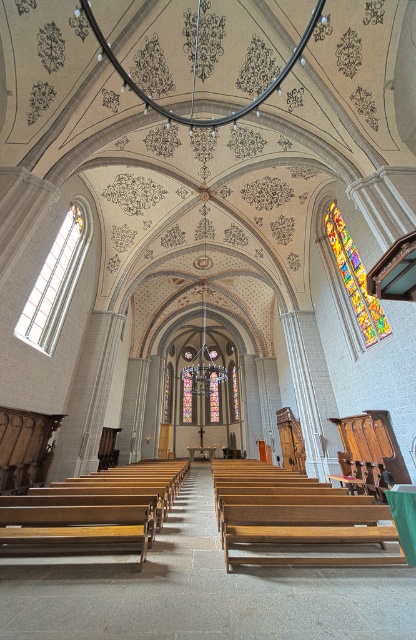
Image resolution: width=416 pixels, height=640 pixels. What are the coordinates of `wooden bench at center` in the screenshot? It's located at (93, 509).

Is point (160, 506) more distant than point (349, 285)?

That is False.

The image size is (416, 640). In order to click on wooden bench at center in this screenshot , I will do click(93, 509).

Does clear glass window at left have a greater height compared to multicolored stained glass at upper right?

Indeed, clear glass window at left has a greater height compared to multicolored stained glass at upper right.

Describe the element at coordinates (56, 282) in the screenshot. I see `clear glass window at left` at that location.

What are the coordinates of `clear glass window at left` in the screenshot? It's located at (56, 282).

Is wooden church bench at center positioned behind multicolored stained glass at upper right?

No, it is not.

Does wooden church bench at center have a lesser width compared to multicolored stained glass at upper right?

In fact, wooden church bench at center might be wider than multicolored stained glass at upper right.

What do you see at coordinates (297, 518) in the screenshot?
I see `wooden church bench at center` at bounding box center [297, 518].

At what (x,y) coordinates should I click in order to perform the action: click on wooden church bench at center. Please return your answer as a coordinate pair (x, y). Image resolution: width=416 pixels, height=640 pixels. Looking at the image, I should click on (297, 518).